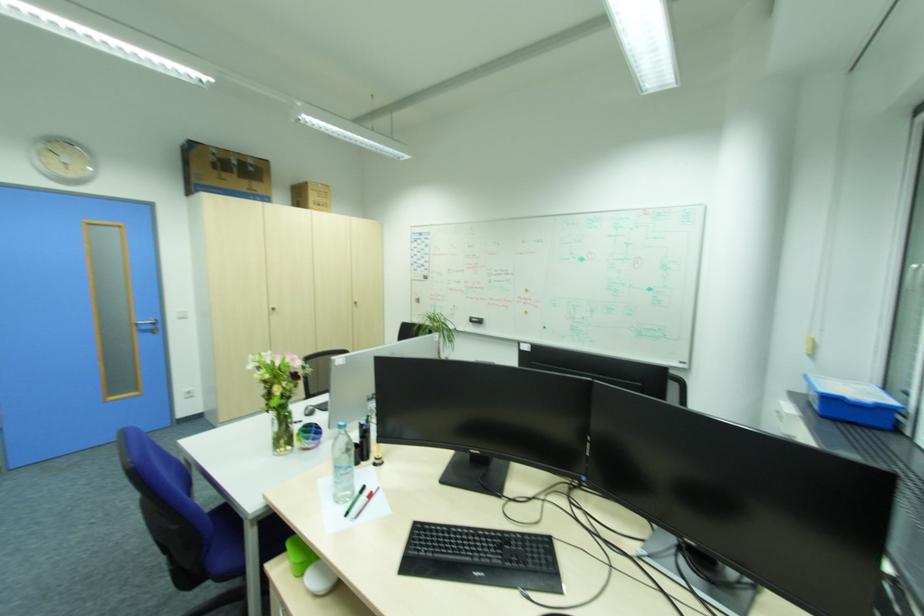
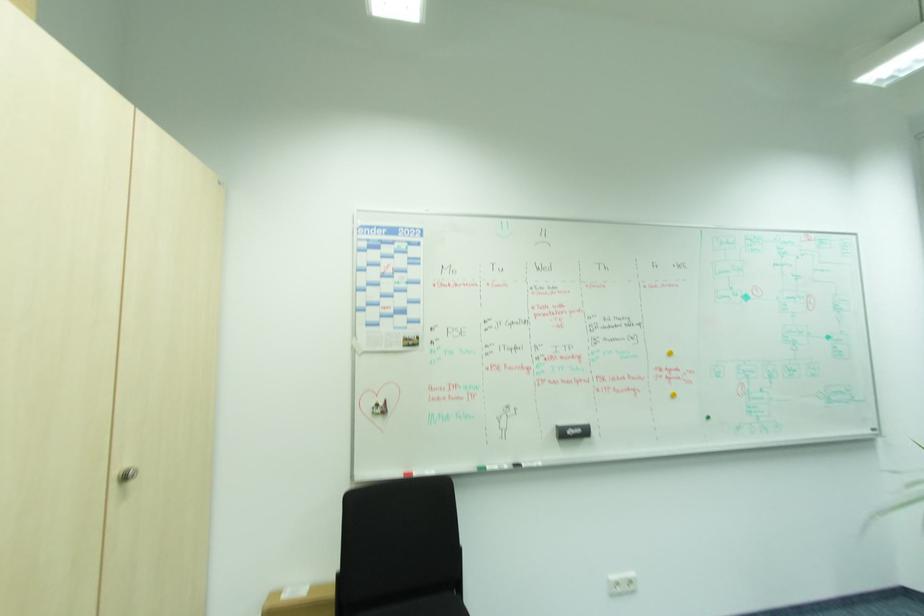
Locate, in the second image, the point that corresponds to the point at 482,318 in the first image.

(584, 430)